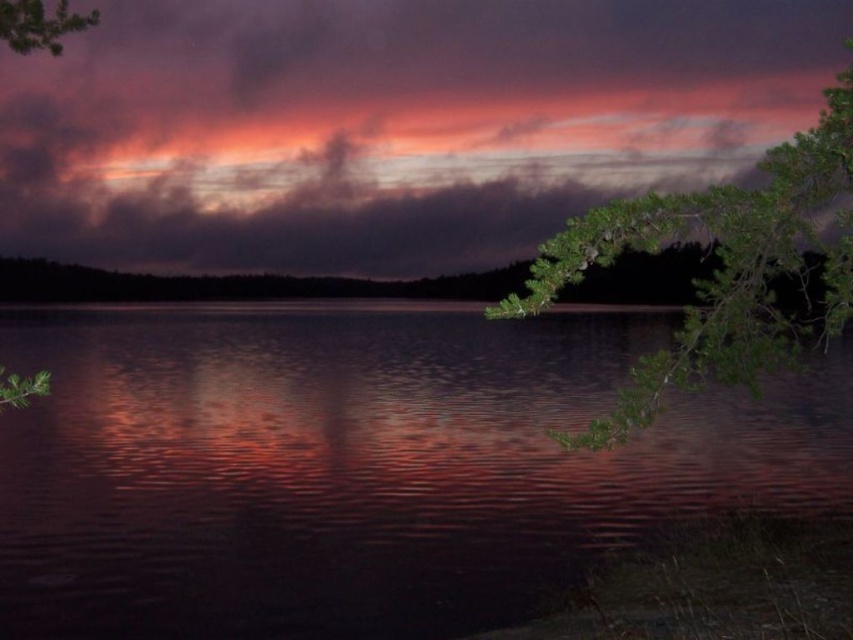
Question: Based on their relative distances, which object is nearer to the glossy water at center?

Choices:
 (A) green leafy branch at right
 (B) green leafy branch at upper left

Answer: (A)

Question: Does cloudy sky at upper center come in front of green leafy branch at upper left?

Choices:
 (A) yes
 (B) no

Answer: (A)

Question: Is glossy water at center smaller than green leafy branch at upper left?

Choices:
 (A) no
 (B) yes

Answer: (A)

Question: Considering the real-world distances, which object is closest to the glossy water at center?

Choices:
 (A) cloudy sky at upper center
 (B) green leafy branch at upper left
 (C) green leafy branch at right

Answer: (A)

Question: Is green leafy branch at right above green leafy branch at upper left?

Choices:
 (A) no
 (B) yes

Answer: (A)

Question: Which object appears closest to the camera in this image?

Choices:
 (A) glossy water at center
 (B) green leafy branch at right

Answer: (B)